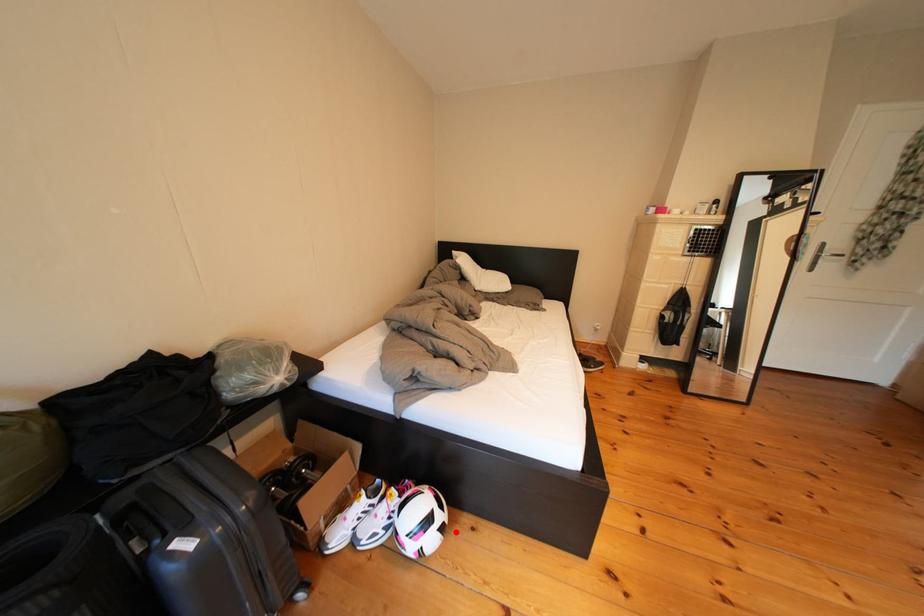
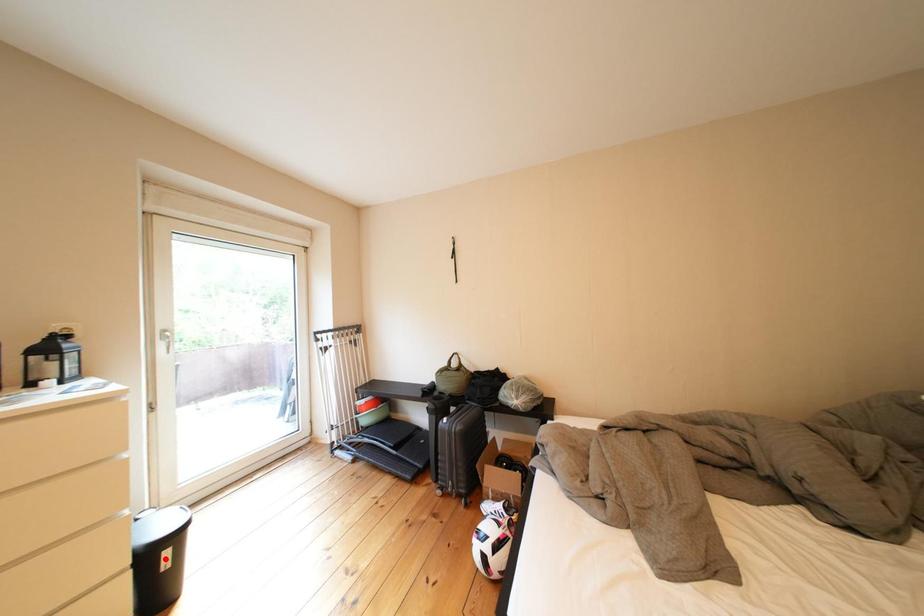
I am providing you with two images of the same scene from different viewpoints. A red point is marked on the first image and another point is marked on the second image. Are the points marked in image1 and image2 representing the same 3D position?

No